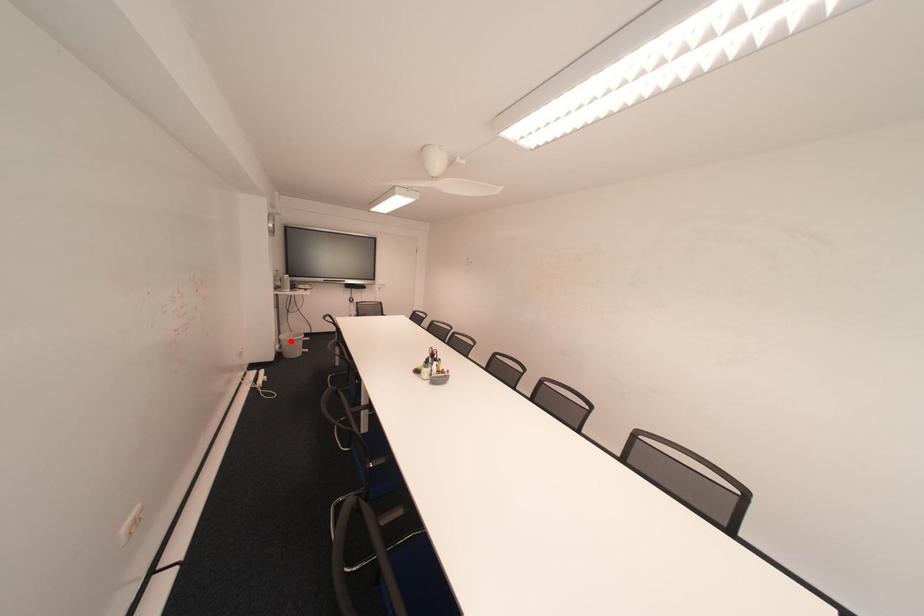
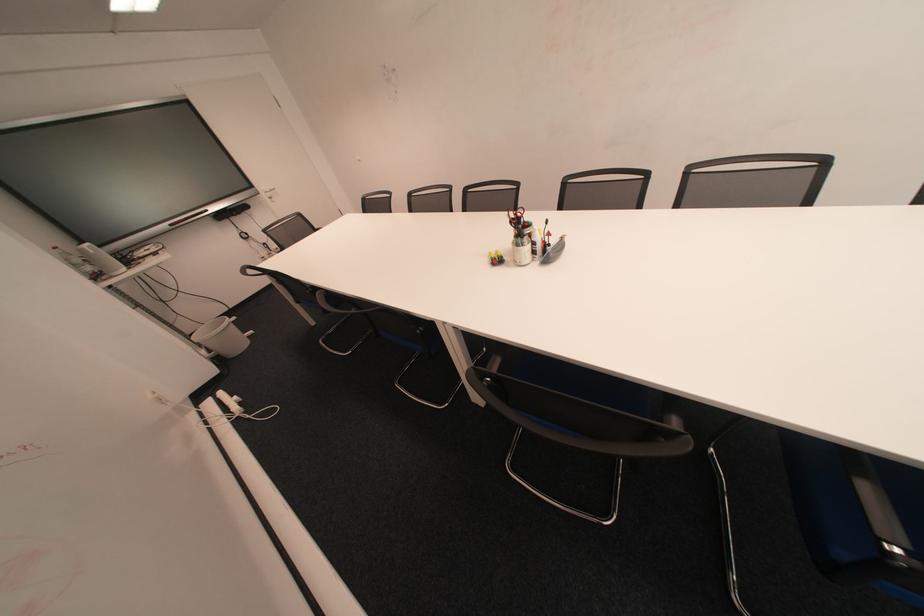
In the second image, find the point that corresponds to the highlighted location in the first image.

(209, 345)